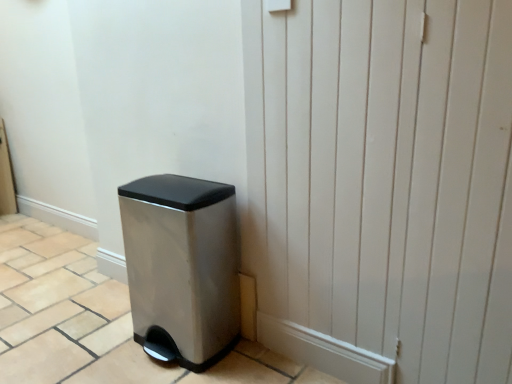
Image resolution: width=512 pixels, height=384 pixels. Describe the element at coordinates (382, 186) in the screenshot. I see `white wood screen door at lower right` at that location.

Where is `white wood screen door at lower right`? white wood screen door at lower right is located at coordinates (382, 186).

What are the coordinates of `satin silver trash can at lower left` in the screenshot? It's located at (182, 267).

In order to face satin silver trash can at lower left, should I rotate leftwards or rightwards?

Rotate left and turn 10.177 degrees.

This screenshot has height=384, width=512. What do you see at coordinates (182, 267) in the screenshot?
I see `satin silver trash can at lower left` at bounding box center [182, 267].

The image size is (512, 384). I want to click on white wood screen door at lower right, so click(382, 186).

Which object is positioned more to the right, satin silver trash can at lower left or white wood screen door at lower right?

Positioned to the right is white wood screen door at lower right.

Is the depth of satin silver trash can at lower left greater than that of white wood screen door at lower right?

That is True.

Considering the points (142, 294) and (308, 342), which point is in front, point (142, 294) or point (308, 342)?

The point (308, 342) is closer.

From the image's perspective, relative to white wood screen door at lower right, is satin silver trash can at lower left above or below?

satin silver trash can at lower left is below white wood screen door at lower right.

From a real-world perspective, which is physically above, satin silver trash can at lower left or white wood screen door at lower right?

white wood screen door at lower right, from a real-world perspective.

Between satin silver trash can at lower left and white wood screen door at lower right, which one has larger width?

satin silver trash can at lower left is wider.

Between satin silver trash can at lower left and white wood screen door at lower right, which one has more height?

Standing taller between the two is white wood screen door at lower right.

In the scene shown: Considering the sizes of objects satin silver trash can at lower left and white wood screen door at lower right in the image provided, who is bigger, satin silver trash can at lower left or white wood screen door at lower right?

satin silver trash can at lower left is bigger.

Is satin silver trash can at lower left completely or partially outside of white wood screen door at lower right?

Absolutely, satin silver trash can at lower left is external to white wood screen door at lower right.

In the scene shown: Is satin silver trash can at lower left touching white wood screen door at lower right?

satin silver trash can at lower left is not next to white wood screen door at lower right, and they're not touching.

Is satin silver trash can at lower left facing away from white wood screen door at lower right?

That's not correct — satin silver trash can at lower left is not looking away from white wood screen door at lower right.

Measure the distance between satin silver trash can at lower left and white wood screen door at lower right.

satin silver trash can at lower left and white wood screen door at lower right are 21.20 inches apart from each other.

Find the location of a particular element. The image size is (512, 384). screen door above the satin silver trash can at lower left (from a real-world perspective) is located at coordinates (382, 186).

Which object is positioned more to the left, white wood screen door at lower right or satin silver trash can at lower left?

satin silver trash can at lower left is more to the left.

Is the depth of white wood screen door at lower right greater than that of satin silver trash can at lower left?

No, it is not.

Is point (475, 306) closer or farther from the camera than point (194, 355)?

Point (475, 306) is positioned closer to the camera compared to point (194, 355).

From the image's perspective, would you say white wood screen door at lower right is positioned over satin silver trash can at lower left?

Yes.

From the picture: From a real-world perspective, is white wood screen door at lower right physically above satin silver trash can at lower left?

Yes, from a real-world perspective, white wood screen door at lower right is on top of satin silver trash can at lower left.

Considering the relative sizes of white wood screen door at lower right and satin silver trash can at lower left in the image provided, is white wood screen door at lower right wider than satin silver trash can at lower left?

No.

Consider the image. Who is taller, white wood screen door at lower right or satin silver trash can at lower left?

white wood screen door at lower right is taller.

Considering the sizes of white wood screen door at lower right and satin silver trash can at lower left in the image, is white wood screen door at lower right bigger or smaller than satin silver trash can at lower left?

Considering their sizes, white wood screen door at lower right takes up less space than satin silver trash can at lower left.

Is white wood screen door at lower right not within satin silver trash can at lower left?

Yes, white wood screen door at lower right is outside of satin silver trash can at lower left.

Would you consider white wood screen door at lower right to be distant from satin silver trash can at lower left?

No, white wood screen door at lower right is not far away from satin silver trash can at lower left.

Could you tell me if white wood screen door at lower right is facing satin silver trash can at lower left?

No, white wood screen door at lower right is not turned towards satin silver trash can at lower left.

How many degrees apart are the facing directions of white wood screen door at lower right and satin silver trash can at lower left?

0.455 degrees separate the facing orientations of white wood screen door at lower right and satin silver trash can at lower left.

At what (x,y) coordinates should I click in order to perform the action: click on waste container below the white wood screen door at lower right (from the image's perspective). Please return your answer as a coordinate pair (x, y). This screenshot has height=384, width=512. Looking at the image, I should click on (182, 267).

Locate an element on the screen. screen door to the right of satin silver trash can at lower left is located at coordinates (382, 186).

Identify the location of waste container behind the white wood screen door at lower right. (182, 267).